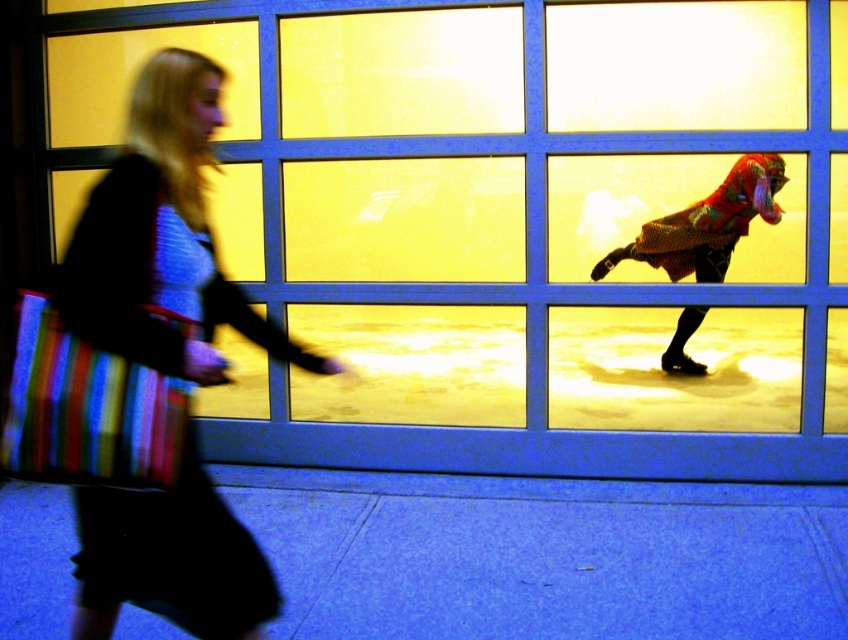
Question: Which point is closer to the camera?

Choices:
 (A) (796, 230)
 (B) (98, 333)
 (C) (784, 604)
 (D) (671, 276)

Answer: (B)

Question: Can you confirm if blue smooth pavement at lower center is thinner than shiny metallic figure at right?

Choices:
 (A) no
 (B) yes

Answer: (A)

Question: In this image, where is yellow glass window at center located relative to striped fabric bag at left?

Choices:
 (A) below
 (B) above

Answer: (B)

Question: Observing the image, what is the correct spatial positioning of blue smooth pavement at lower center in reference to shiny metallic figure at right?

Choices:
 (A) below
 (B) above

Answer: (A)

Question: Which of the following is the closest to the observer?

Choices:
 (A) yellow glass window at center
 (B) striped fabric bag at left

Answer: (B)

Question: Which point is closer to the camera?

Choices:
 (A) yellow glass window at center
 (B) striped fabric bag at left
 (C) shiny metallic figure at right

Answer: (B)